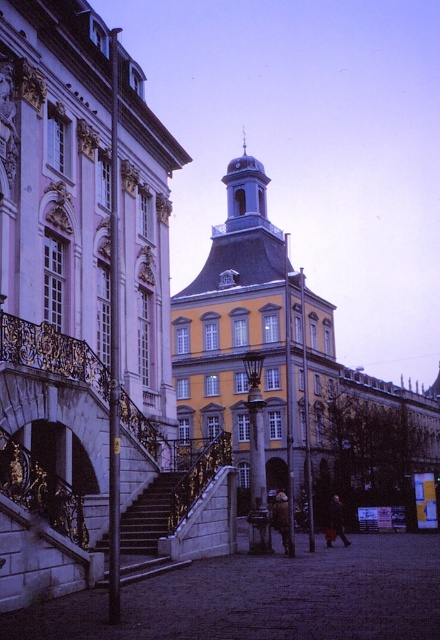
You are a city planner evaluating the space between the yellow matte building at center and the dark gray stone stairs at center. If you want to install a new bench that is 2 meters wide, can you confirm if there is enough space between them?

The yellow matte building at center might be wider than dark gray stone stairs at center, so the space between them may not be sufficient for a 2 meter wide bench. Further measurements are needed to confirm.

You are a delivery person who needs to place a dark brown leather coat at center on top of the dark gray stone stairs at center. Can you do this without the coat falling off?

The dark gray stone stairs at center is not as tall as the dark brown leather coat at center, so placing the coat on top may be unstable because the stairs are shorter than the coat in height. The coat might tip over or slide off.